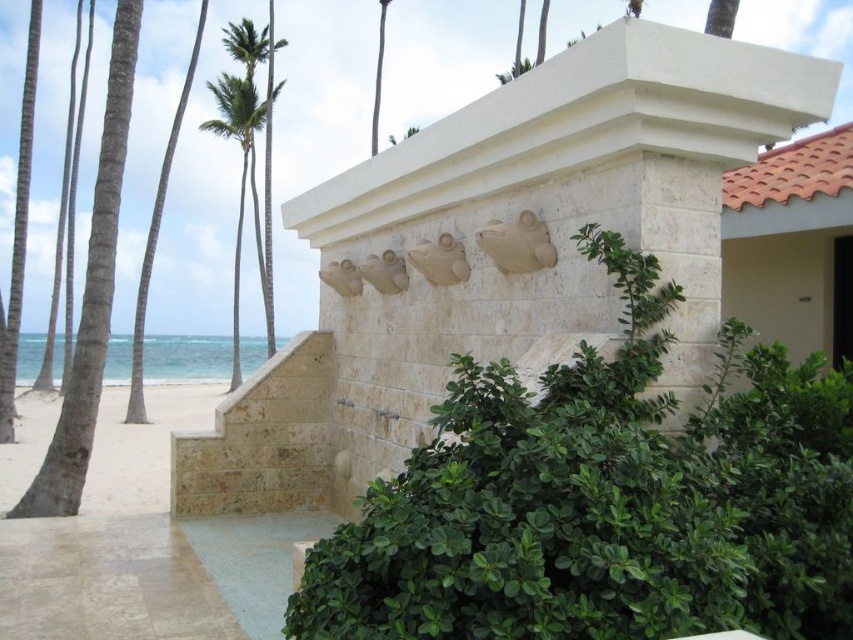
Looking at this image, does beige stone steps at lower left have a larger size compared to natural stone stairs at center?

Yes.

From the picture: Which is more to the left, beige stone steps at lower left or natural stone stairs at center?

beige stone steps at lower left is more to the left.

Image resolution: width=853 pixels, height=640 pixels. Find the location of `beige stone steps at lower left`. beige stone steps at lower left is located at coordinates (146, 547).

The image size is (853, 640). I want to click on beige stone steps at lower left, so click(x=146, y=547).

Is beige stone steps at lower left positioned at the back of green leafy palm tree at upper left?

No, beige stone steps at lower left is in front of green leafy palm tree at upper left.

Can you confirm if beige stone steps at lower left is smaller than green leafy palm tree at upper left?

Yes.

What do you see at coordinates (146, 547) in the screenshot? Image resolution: width=853 pixels, height=640 pixels. I see `beige stone steps at lower left` at bounding box center [146, 547].

The width and height of the screenshot is (853, 640). I want to click on beige stone steps at lower left, so click(x=146, y=547).

Who is taller, natural stone stairs at center or green leafy palm tree at upper left?

green leafy palm tree at upper left is taller.

Locate an element on the screen. The width and height of the screenshot is (853, 640). natural stone stairs at center is located at coordinates (262, 440).

Locate an element on the screen. The width and height of the screenshot is (853, 640). natural stone stairs at center is located at coordinates (262, 440).